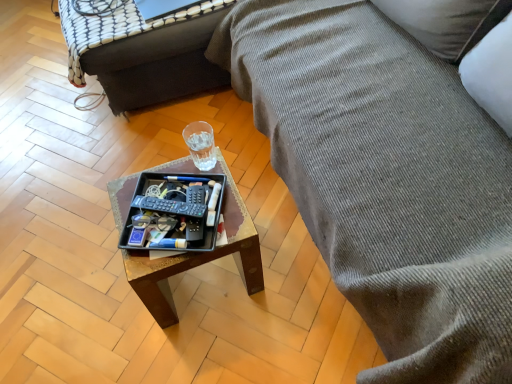
Image resolution: width=512 pixels, height=384 pixels. Identify the location of empty space that is to the right of wooden tray at center. (287, 274).